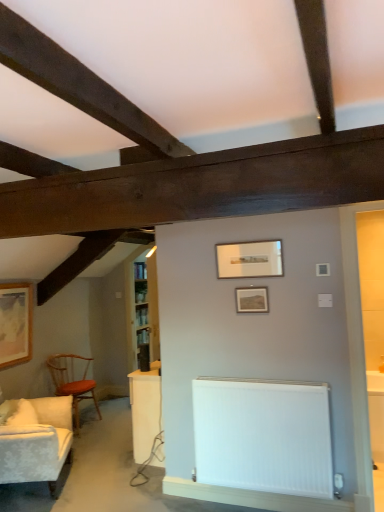
Question: From a real-world perspective, does wooden framed picture at left, the 3th picture frame from the right, stand above white glossy table at lower right?

Choices:
 (A) no
 (B) yes

Answer: (B)

Question: Are wooden framed picture at left, positioned as the third picture frame in top-to-bottom order, and white glossy table at lower right located far from each other?

Choices:
 (A) no
 (B) yes

Answer: (B)

Question: Is wooden framed picture at left, the 3th picture frame from the right, taller than white glossy table at lower right?

Choices:
 (A) no
 (B) yes

Answer: (B)

Question: Is wooden framed picture at left, which is the 3th picture frame in front-to-back order, located outside white glossy table at lower right?

Choices:
 (A) yes
 (B) no

Answer: (A)

Question: Does wooden framed picture at left, which is counted as the 1th picture frame, starting from the bottom, have a lesser width compared to white glossy table at lower right?

Choices:
 (A) no
 (B) yes

Answer: (B)

Question: In the image, is white textured fabric couch at left positioned in front of or behind white smooth radiator at lower center?

Choices:
 (A) behind
 (B) front

Answer: (A)

Question: Visually, is white textured fabric couch at left positioned to the left or to the right of white smooth radiator at lower center?

Choices:
 (A) right
 (B) left

Answer: (B)

Question: From the image's perspective, is white textured fabric couch at left positioned above or below white smooth radiator at lower center?

Choices:
 (A) below
 (B) above

Answer: (A)

Question: From a real-world perspective, is white textured fabric couch at left physically located above or below white smooth radiator at lower center?

Choices:
 (A) below
 (B) above

Answer: (A)

Question: Is white glossy table at lower right inside the boundaries of white smooth radiator at lower center, or outside?

Choices:
 (A) inside
 (B) outside

Answer: (B)

Question: Considering their positions, is white glossy table at lower right located in front of or behind white smooth radiator at lower center?

Choices:
 (A) front
 (B) behind

Answer: (B)

Question: Is point (382, 376) positioned closer to the camera than point (319, 434)?

Choices:
 (A) closer
 (B) farther

Answer: (B)

Question: From a real-world perspective, is white glossy table at lower right positioned above or below white smooth radiator at lower center?

Choices:
 (A) below
 (B) above

Answer: (A)

Question: Looking at their shapes, would you say matte wooden picture frame at center, positioned as the 2th picture frame in back-to-front order, is wider or thinner than wooden polished chair at left?

Choices:
 (A) wide
 (B) thin

Answer: (B)

Question: From the image's perspective, is matte wooden picture frame at center, positioned as the second picture frame in top-to-bottom order, positioned above or below wooden polished chair at left?

Choices:
 (A) above
 (B) below

Answer: (A)